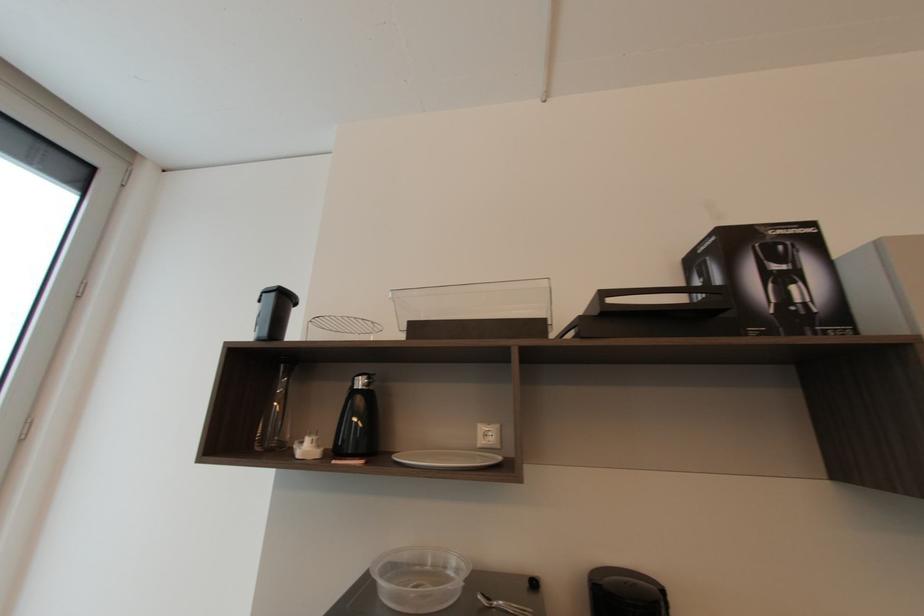
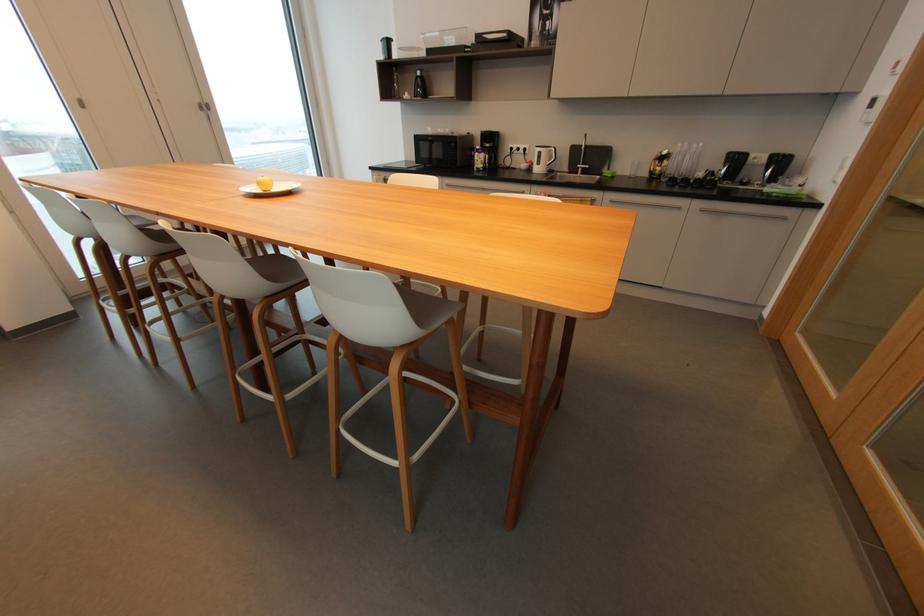
The point at (x=362, y=384) is marked in the first image. Where is the corresponding point in the second image?

(421, 74)